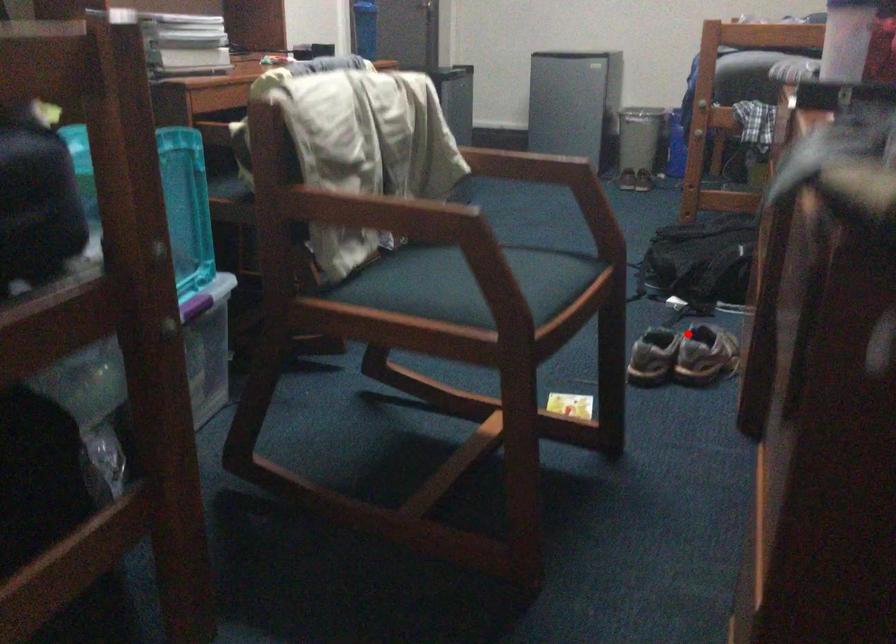
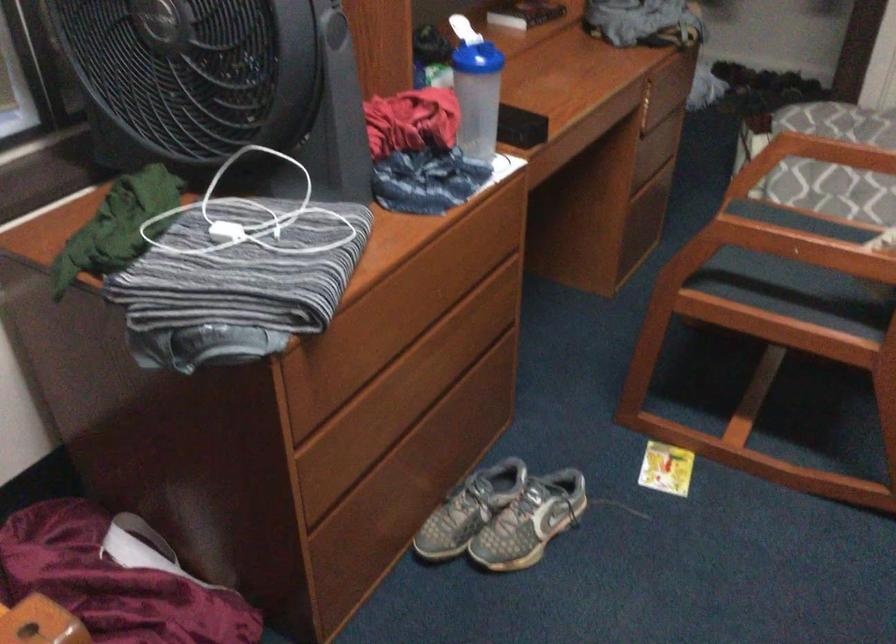
The point at the highlighted location is marked in the first image. Where is the corresponding point in the second image?

(503, 516)